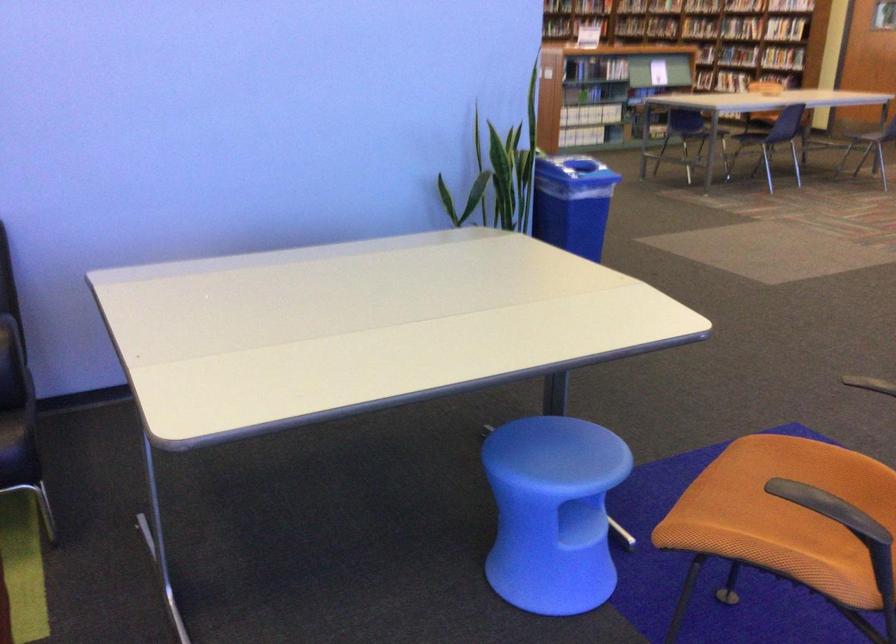
This screenshot has width=896, height=644. What do you see at coordinates (785, 503) in the screenshot?
I see `the orange chair sitting surface` at bounding box center [785, 503].